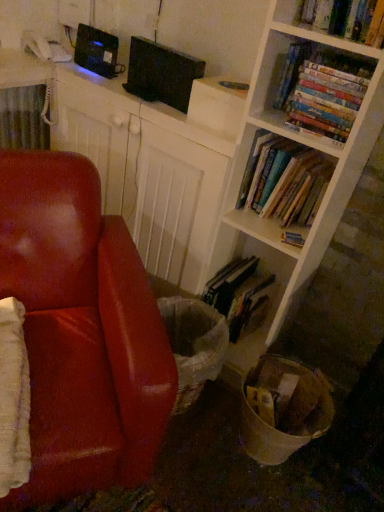
Question: Considering the relative sizes of black matte computer at upper center and hardcover books at upper right, which appears as the 1th book when viewed from the top, in the image provided, is black matte computer at upper center taller than hardcover books at upper right, which appears as the 1th book when viewed from the top,?

Choices:
 (A) no
 (B) yes

Answer: (B)

Question: From a real-world perspective, is black matte computer at upper center located beneath hardcover books at upper right, acting as the fourth book starting from the bottom?

Choices:
 (A) no
 (B) yes

Answer: (B)

Question: Is black matte computer at upper center smaller than hardcover books at upper right, which appears as the 1th book when viewed from the top?

Choices:
 (A) yes
 (B) no

Answer: (B)

Question: From the image's perspective, is black matte computer at upper center above hardcover books at upper right, acting as the fourth book starting from the bottom?

Choices:
 (A) yes
 (B) no

Answer: (B)

Question: Does black matte computer at upper center have a lesser height compared to hardcover books at upper right, acting as the fourth book starting from the bottom?

Choices:
 (A) yes
 (B) no

Answer: (B)

Question: From a real-world perspective, is black matte computer at upper center above or below leather at left?

Choices:
 (A) below
 (B) above

Answer: (B)

Question: In the image, is black matte computer at upper center positioned in front of or behind leather at left?

Choices:
 (A) behind
 (B) front

Answer: (A)

Question: In the image, is black matte computer at upper center on the left side or the right side of leather at left?

Choices:
 (A) right
 (B) left

Answer: (A)

Question: In terms of width, does black matte computer at upper center look wider or thinner when compared to leather at left?

Choices:
 (A) thin
 (B) wide

Answer: (A)

Question: Looking at their shapes, would you say hardcover book at lower center, which is the 4th book from top to bottom, is wider or thinner than hardcover books at center right, which is counted as the third book, starting from the bottom?

Choices:
 (A) thin
 (B) wide

Answer: (B)

Question: Considering the positions of hardcover book at lower center, which is the 4th book from top to bottom, and hardcover books at center right, which is counted as the third book, starting from the bottom, in the image, is hardcover book at lower center, which is the 4th book from top to bottom, bigger or smaller than hardcover books at center right, which is counted as the third book, starting from the bottom,?

Choices:
 (A) small
 (B) big

Answer: (B)

Question: From a real-world perspective, is hardcover book at lower center, which is the 4th book from top to bottom, positioned above or below hardcover books at center right, which is counted as the third book, starting from the bottom?

Choices:
 (A) below
 (B) above

Answer: (A)

Question: Would you say hardcover book at lower center, which is the 4th book from top to bottom, is to the left or to the right of hardcover books at center right, which is counted as the third book, starting from the bottom, in the picture?

Choices:
 (A) left
 (B) right

Answer: (A)

Question: Looking at their shapes, would you say hardcover books at upper right, which appears as the 1th book when viewed from the top, is wider or thinner than black matte computer at upper center?

Choices:
 (A) thin
 (B) wide

Answer: (A)

Question: Considering their positions, is hardcover books at upper right, which appears as the 1th book when viewed from the top, located in front of or behind black matte computer at upper center?

Choices:
 (A) front
 (B) behind

Answer: (A)